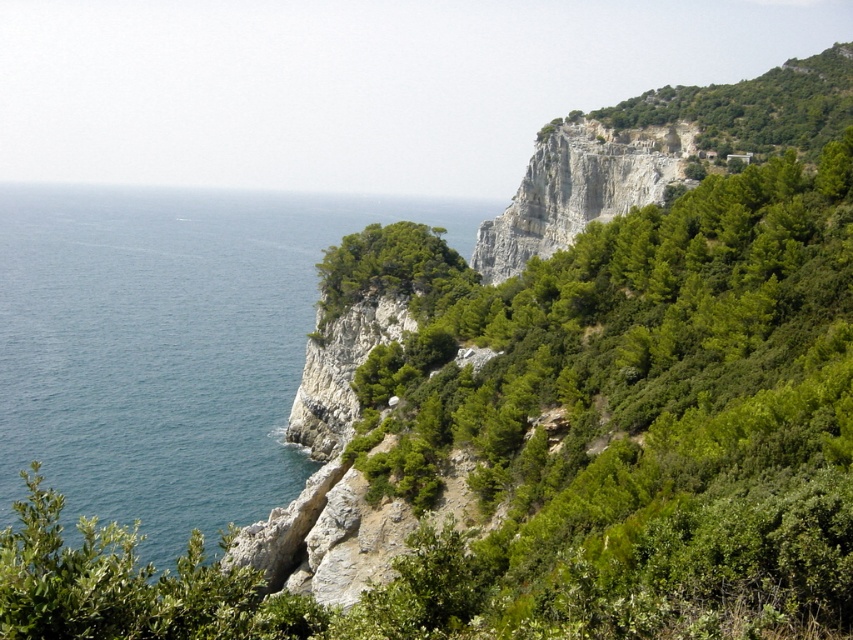
Question: Does green leafy shrub at upper right have a lesser width compared to blue water at left?

Choices:
 (A) no
 (B) yes

Answer: (B)

Question: Which object is farther from the camera taking this photo?

Choices:
 (A) blue water at left
 (B) green leafy shrub at upper right

Answer: (A)

Question: Is green leafy shrub at upper right to the left of blue water at left from the viewer's perspective?

Choices:
 (A) no
 (B) yes

Answer: (A)

Question: Which point is closer to the camera?

Choices:
 (A) (358, 452)
 (B) (276, 445)

Answer: (A)

Question: Is green leafy shrub at upper right behind blue water at left?

Choices:
 (A) yes
 (B) no

Answer: (B)

Question: Which point is farther from the camera taking this photo?

Choices:
 (A) (334, 208)
 (B) (567, 273)

Answer: (A)